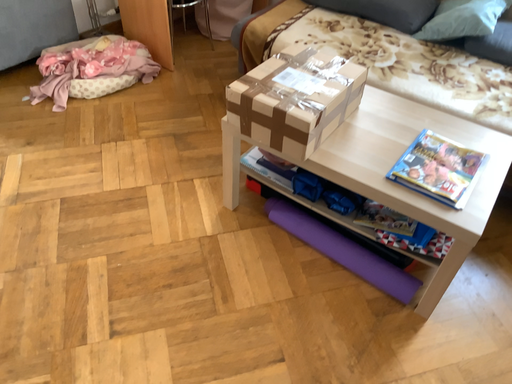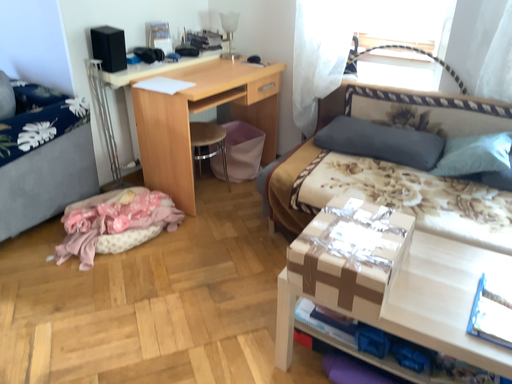
Question: Which way did the camera rotate in the video?

Choices:
 (A) rotated upward
 (B) rotated downward

Answer: (A)